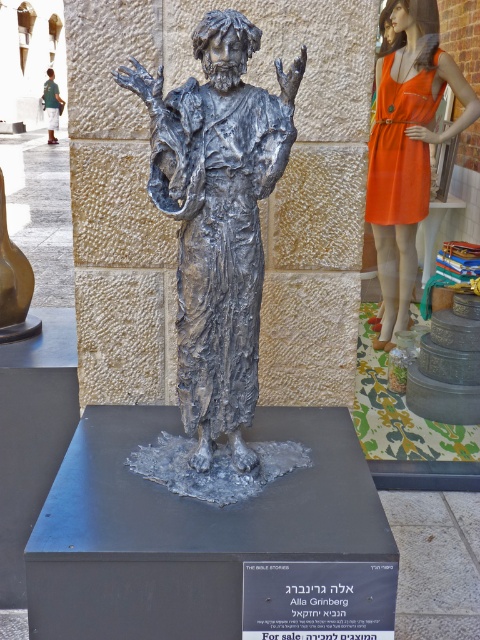
Is shiny silver statue at center above orange fabric dress at upper right?

No, shiny silver statue at center is not above orange fabric dress at upper right.

Can you confirm if shiny silver statue at center is thinner than orange fabric dress at upper right?

Indeed, shiny silver statue at center has a lesser width compared to orange fabric dress at upper right.

Who is more forward, (137, 458) or (429, 19)?

Point (137, 458) is in front.

Where is `shiny silver statue at center`? This screenshot has height=640, width=480. shiny silver statue at center is located at coordinates (217, 253).

Who is lower down, shiny silver statue at center or green fabric dress at upper left?

shiny silver statue at center is lower down.

I want to click on shiny silver statue at center, so click(217, 253).

The width and height of the screenshot is (480, 640). Identify the location of shiny silver statue at center. (217, 253).

Does orange fabric dress at upper right have a smaller size compared to green fabric dress at upper left?

No.

Measure the distance between orange fabric dress at upper right and camera.

5.32 meters

This screenshot has width=480, height=640. Find the location of `orange fabric dress at upper right`. orange fabric dress at upper right is located at coordinates (407, 147).